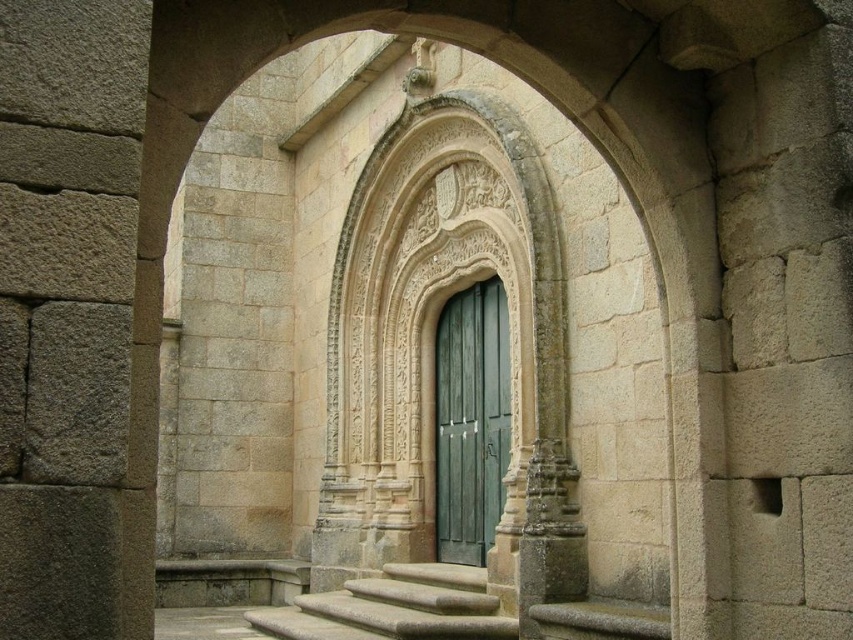
Which is above, green wooden door at center or smooth gray stone stairs at center?

green wooden door at center

Where is `green wooden door at center`? The height and width of the screenshot is (640, 853). green wooden door at center is located at coordinates (471, 420).